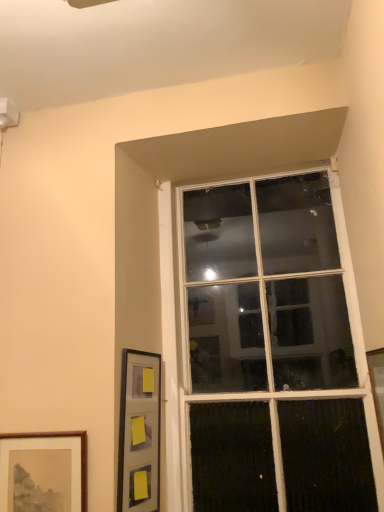
Question: Is clear glass window at upper center at the right side of wooden picture frame at right, placed as the first picture frame when sorted from right to left?

Choices:
 (A) no
 (B) yes

Answer: (A)

Question: Is clear glass window at upper center to the left of wooden picture frame at right, which is the 3th picture frame in left-to-right order, from the viewer's perspective?

Choices:
 (A) yes
 (B) no

Answer: (A)

Question: Could you tell me if clear glass window at upper center is facing wooden picture frame at right, which is the 3th picture frame in left-to-right order?

Choices:
 (A) no
 (B) yes

Answer: (B)

Question: Does clear glass window at upper center have a greater height compared to wooden picture frame at right, which is the 3th picture frame in left-to-right order?

Choices:
 (A) yes
 (B) no

Answer: (A)

Question: Considering the relative sizes of clear glass window at upper center and wooden picture frame at right, which is the 3th picture frame in left-to-right order, in the image provided, is clear glass window at upper center shorter than wooden picture frame at right, which is the 3th picture frame in left-to-right order,?

Choices:
 (A) no
 (B) yes

Answer: (A)

Question: Is point (382, 434) closer or farther from the camera than point (150, 415)?

Choices:
 (A) farther
 (B) closer

Answer: (B)

Question: In the image, is wooden picture frame at right, placed as the first picture frame when sorted from right to left, positioned in front of or behind matte black picture frame at lower left, the second picture frame positioned from the right?

Choices:
 (A) behind
 (B) front

Answer: (B)

Question: From the image's perspective, is wooden picture frame at right, placed as the first picture frame when sorted from right to left, positioned above or below matte black picture frame at lower left, the second picture frame positioned from the right?

Choices:
 (A) below
 (B) above

Answer: (B)

Question: Looking at their shapes, would you say wooden picture frame at right, placed as the first picture frame when sorted from right to left, is wider or thinner than matte black picture frame at lower left, arranged as the 2th picture frame when viewed from the left?

Choices:
 (A) thin
 (B) wide

Answer: (B)

Question: Is wooden picture frame at right, which is the 3th picture frame in left-to-right order, situated inside clear glass window at upper center or outside?

Choices:
 (A) inside
 (B) outside

Answer: (B)

Question: Considering the positions of wooden picture frame at right, which is the 3th picture frame in left-to-right order, and clear glass window at upper center in the image, is wooden picture frame at right, which is the 3th picture frame in left-to-right order, taller or shorter than clear glass window at upper center?

Choices:
 (A) tall
 (B) short

Answer: (B)

Question: In the image, is wooden picture frame at right, placed as the first picture frame when sorted from right to left, on the left side or the right side of clear glass window at upper center?

Choices:
 (A) right
 (B) left

Answer: (A)

Question: From a real-world perspective, is wooden picture frame at right, which is the 3th picture frame in left-to-right order, above or below clear glass window at upper center?

Choices:
 (A) above
 (B) below

Answer: (B)

Question: Looking at the image, does brown wooden picture frame at lower left, arranged as the third picture frame when viewed from the right, seem bigger or smaller compared to clear glass window at upper center?

Choices:
 (A) big
 (B) small

Answer: (B)

Question: From the image's perspective, relative to clear glass window at upper center, is brown wooden picture frame at lower left, positioned as the first picture frame in left-to-right order, above or below?

Choices:
 (A) below
 (B) above

Answer: (A)